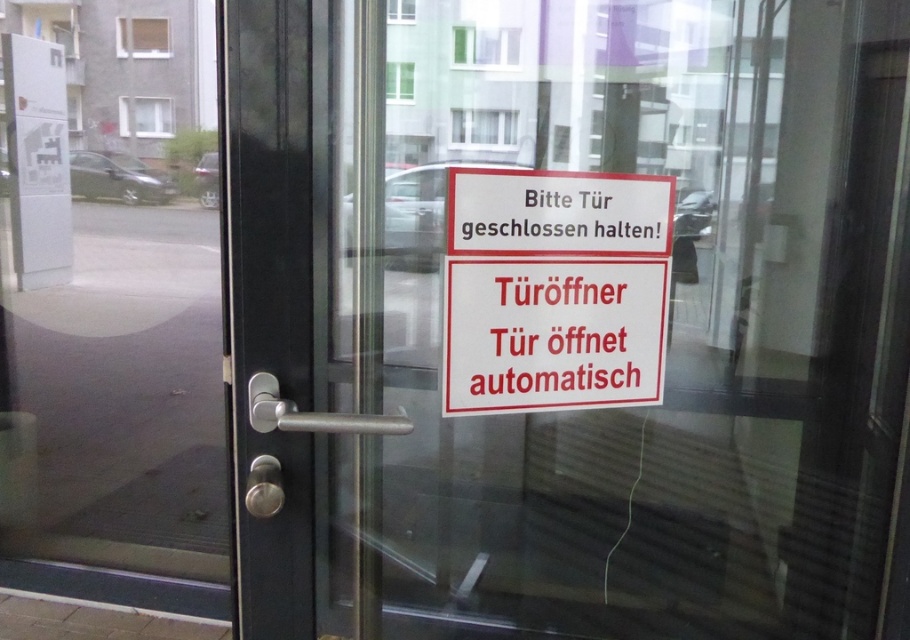
You are a delivery person with a cart that is 2 meters wide. You need to move through the space between the transparent glass door at center and the white plastic parking sign at upper left. Can your cart fit through the space between them?

The transparent glass door at center and the white plastic parking sign at upper left are 2.50 meters apart from each other. Since your cart is 2 meters wide, it can fit through the space between them as the distance is greater than the cart width.

From the picture: You are a delivery person approaching the glass door with a heavy package. You see the red plastic sign at center and the white plastic parking sign at upper left. Which sign is shorter?

The red plastic sign at center is shorter than the white plastic parking sign at upper left.